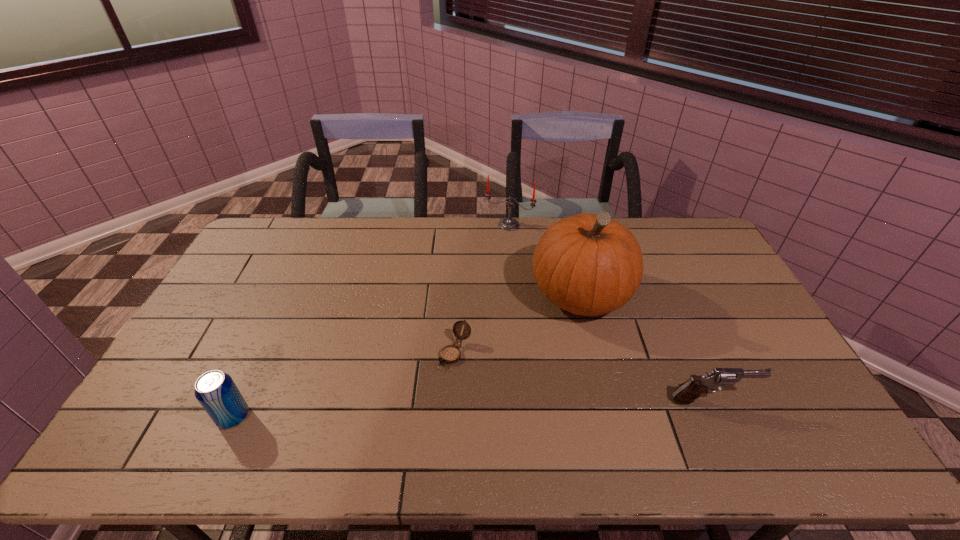
Where is `free area in between the beer can and the farthest object`? Image resolution: width=960 pixels, height=540 pixels. free area in between the beer can and the farthest object is located at coordinates (372, 321).

Where is `empty space that is in between the beer can and the compass`? empty space that is in between the beer can and the compass is located at coordinates (345, 385).

Image resolution: width=960 pixels, height=540 pixels. I want to click on free space between the pistol and the beer can, so click(x=472, y=408).

This screenshot has width=960, height=540. In order to click on free space between the beer can and the third nearest object in this screenshot , I will do `click(345, 385)`.

Where is `free space between the fourth nearest object and the beer can`? free space between the fourth nearest object and the beer can is located at coordinates (407, 356).

The width and height of the screenshot is (960, 540). Find the location of `vacant space that's between the shortest object and the candle`. vacant space that's between the shortest object and the candle is located at coordinates (482, 289).

Find the location of a particular element. The height and width of the screenshot is (540, 960). vacant space in between the leftmost object and the shortest object is located at coordinates (345, 385).

Point out which object is positioned as the fourth nearest to the fourth shortest object. Please provide its 2D coordinates. Your answer should be formatted as a tuple, i.e. [(x, y)], where the tuple contains the x and y coordinates of a point satisfying the conditions above.

[(215, 390)]

The width and height of the screenshot is (960, 540). Find the location of `object identified as the closest to the third nearest object`. object identified as the closest to the third nearest object is located at coordinates (588, 264).

The image size is (960, 540). Identify the location of free space that satisfies the following two spatial constraints: 1. on the back side of the compass; 2. on the left side of the second farthest object. (458, 296).